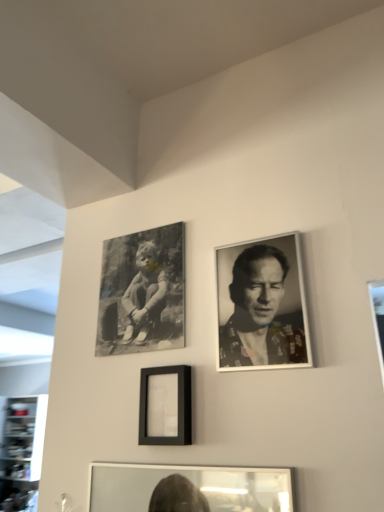
Question: Does black matte canvas at upper left, the second picture frame viewed from the front, come in front of black and white portrait at upper right?

Choices:
 (A) yes
 (B) no

Answer: (B)

Question: Can you confirm if black matte canvas at upper left, the second picture frame viewed from the front, is shorter than black and white portrait at upper right?

Choices:
 (A) no
 (B) yes

Answer: (A)

Question: Is black matte canvas at upper left, which appears as the 1th picture frame when viewed from the top, oriented away from black and white portrait at upper right?

Choices:
 (A) no
 (B) yes

Answer: (A)

Question: Considering the relative sizes of black matte canvas at upper left, the second picture frame viewed from the front, and black and white portrait at upper right in the image provided, is black matte canvas at upper left, the second picture frame viewed from the front, thinner than black and white portrait at upper right?

Choices:
 (A) yes
 (B) no

Answer: (A)

Question: Considering the relative sizes of black matte canvas at upper left, which appears as the 1th picture frame when viewed from the top, and black and white portrait at upper right in the image provided, is black matte canvas at upper left, which appears as the 1th picture frame when viewed from the top, smaller than black and white portrait at upper right?

Choices:
 (A) no
 (B) yes

Answer: (A)

Question: From the image's perspective, is black matte canvas at upper left, the first picture frame in the back-to-front sequence, under black and white portrait at upper right?

Choices:
 (A) yes
 (B) no

Answer: (B)

Question: Is black matte canvas at upper left, the first picture frame in the back-to-front sequence, to the right of matte black frame at center, arranged as the second picture frame when viewed from the back, from the viewer's perspective?

Choices:
 (A) no
 (B) yes

Answer: (A)

Question: From a real-world perspective, is black matte canvas at upper left, the first picture frame in the back-to-front sequence, beneath matte black frame at center, arranged as the second picture frame when viewed from the back?

Choices:
 (A) yes
 (B) no

Answer: (B)

Question: Considering the relative sizes of black matte canvas at upper left, the second picture frame viewed from the front, and matte black frame at center, placed as the 2th picture frame when sorted from top to bottom, in the image provided, is black matte canvas at upper left, the second picture frame viewed from the front, thinner than matte black frame at center, placed as the 2th picture frame when sorted from top to bottom,?

Choices:
 (A) yes
 (B) no

Answer: (A)

Question: From the image's perspective, would you say black matte canvas at upper left, the second picture frame viewed from the front, is positioned over matte black frame at center, the first picture frame positioned from the bottom?

Choices:
 (A) no
 (B) yes

Answer: (B)

Question: Considering the relative sizes of black matte canvas at upper left, the second picture frame viewed from the front, and matte black frame at center, placed as the 2th picture frame when sorted from top to bottom, in the image provided, is black matte canvas at upper left, the second picture frame viewed from the front, taller than matte black frame at center, placed as the 2th picture frame when sorted from top to bottom,?

Choices:
 (A) yes
 (B) no

Answer: (A)

Question: Are black matte canvas at upper left, which appears as the 1th picture frame when viewed from the top, and matte black frame at center, the first picture frame when ordered from front to back, beside each other?

Choices:
 (A) yes
 (B) no

Answer: (B)

Question: Are matte black frame at center, placed as the 2th picture frame when sorted from top to bottom, and black matte canvas at upper left, which appears as the 1th picture frame when viewed from the top, beside each other?

Choices:
 (A) no
 (B) yes

Answer: (A)